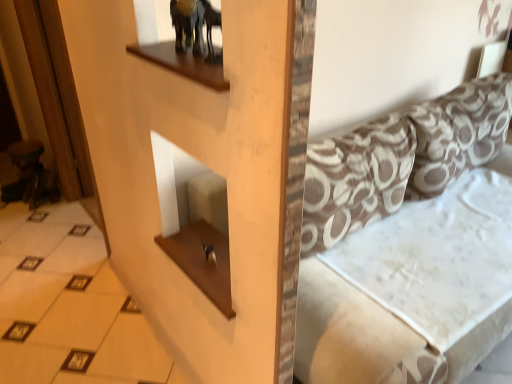
You are a GUI agent. You are given a task and a screenshot of the screen. Output one action in this format:
    pyautogui.click(x=<x>, y=<y>)
    Task: Click on the brown printed fabric pillow at upper right, the 2th pillow positioned from the right
    The image size is (512, 384).
    Given the screenshot: What is the action you would take?
    pyautogui.click(x=355, y=180)

The image size is (512, 384). Describe the element at coordinates (410, 246) in the screenshot. I see `patterned fabric couch at center` at that location.

The image size is (512, 384). In order to click on white glossy tile at lower left in this screenshot , I will do `click(70, 306)`.

At what (x,y) coordinates should I click in order to perform the action: click on brown printed fabric pillow at upper right, the first pillow in the left-to-right sequence. Please return your answer as a coordinate pair (x, y). The image size is (512, 384). Looking at the image, I should click on (355, 180).

Considering the points (370, 227) and (476, 94), which point is behind, point (370, 227) or point (476, 94)?

The point (476, 94) is behind.

Is patterned fabric couch at center inside the boundaries of patterned fabric pillow at right, which is counted as the 1th pillow, starting from the right, or outside?

patterned fabric couch at center is located beyond the bounds of patterned fabric pillow at right, which is counted as the 1th pillow, starting from the right.

Does patterned fabric couch at center have a larger size compared to patterned fabric pillow at right, the 2th pillow positioned from the left?

Correct, patterned fabric couch at center is larger in size than patterned fabric pillow at right, the 2th pillow positioned from the left.

I want to click on the 2nd pillow above when counting from the white glossy tile at lower left (from the image's perspective), so click(458, 132).

Does patterned fabric pillow at right, the 2th pillow positioned from the left, touch white glossy tile at lower left?

patterned fabric pillow at right, the 2th pillow positioned from the left, is not next to white glossy tile at lower left, and they're not touching.

Does patterned fabric pillow at right, which is counted as the 1th pillow, starting from the right, appear on the left side of white glossy tile at lower left?

No.

Does patterned fabric pillow at right, which is counted as the 1th pillow, starting from the right, turn towards white glossy tile at lower left?

No, patterned fabric pillow at right, which is counted as the 1th pillow, starting from the right, is not aimed at white glossy tile at lower left.

Which is in front, point (436, 99) or point (452, 184)?

The point (452, 184) is closer.

Does patterned fabric pillow at right, which is counted as the 1th pillow, starting from the right, turn towards patterned fabric couch at center?

Yes, patterned fabric pillow at right, which is counted as the 1th pillow, starting from the right, faces towards patterned fabric couch at center.

Is patterned fabric pillow at right, the 2th pillow positioned from the left, completely or partially outside of patterned fabric couch at center?

Actually, patterned fabric pillow at right, the 2th pillow positioned from the left, is within patterned fabric couch at center.

Can you confirm if patterned fabric pillow at right, the 2th pillow positioned from the left, is positioned to the left of patterned fabric couch at center?

In fact, patterned fabric pillow at right, the 2th pillow positioned from the left, is to the right of patterned fabric couch at center.

Can you tell me how much white glossy tile at lower left and patterned fabric couch at center differ in facing direction?

The facing directions of white glossy tile at lower left and patterned fabric couch at center are 90 degrees apart.

Which is less distant, (22, 273) or (470, 142)?

Point (22, 273) is positioned farther from the camera compared to point (470, 142).

From a real-world perspective, who is located higher, white glossy tile at lower left or patterned fabric couch at center?

In real-world perspective, patterned fabric couch at center is above.

Is white glossy tile at lower left in contact with patterned fabric couch at center?

No, white glossy tile at lower left is not with patterned fabric couch at center.

Consider the image. Does white glossy tile at lower left lie behind patterned fabric pillow at right, the 2th pillow positioned from the left?

No, white glossy tile at lower left is closer to the viewer.

Is point (16, 242) farther from camera compared to point (425, 167)?

Yes, it is behind point (425, 167).

Where is `tile that is on the left side of patterned fabric pillow at right, which is counted as the 1th pillow, starting from the right`? tile that is on the left side of patterned fabric pillow at right, which is counted as the 1th pillow, starting from the right is located at coordinates (70, 306).

From a real-world perspective, is patterned fabric pillow at right, the 2th pillow positioned from the left, physically located above or below brown printed fabric pillow at upper right, the first pillow in the left-to-right sequence?

patterned fabric pillow at right, the 2th pillow positioned from the left, is situated higher than brown printed fabric pillow at upper right, the first pillow in the left-to-right sequence, in the real world.

Between patterned fabric pillow at right, which is counted as the 1th pillow, starting from the right, and brown printed fabric pillow at upper right, the 2th pillow positioned from the right, which one has less height?

With less height is brown printed fabric pillow at upper right, the 2th pillow positioned from the right.

Is point (440, 163) closer or farther from the camera than point (341, 152)?

Point (440, 163) is farther from the camera than point (341, 152).

Is patterned fabric pillow at right, which is counted as the 1th pillow, starting from the right, at the right side of brown printed fabric pillow at upper right, the 2th pillow positioned from the right?

Indeed, patterned fabric pillow at right, which is counted as the 1th pillow, starting from the right, is positioned on the right side of brown printed fabric pillow at upper right, the 2th pillow positioned from the right.

Is patterned fabric couch at center thinner than brown printed fabric pillow at upper right, the 2th pillow positioned from the right?

In fact, patterned fabric couch at center might be wider than brown printed fabric pillow at upper right, the 2th pillow positioned from the right.

Can you confirm if patterned fabric couch at center is bigger than brown printed fabric pillow at upper right, the 2th pillow positioned from the right?

Yes, patterned fabric couch at center is bigger than brown printed fabric pillow at upper right, the 2th pillow positioned from the right.

Is patterned fabric couch at center facing towards brown printed fabric pillow at upper right, the first pillow in the left-to-right sequence?

No, patterned fabric couch at center is not facing towards brown printed fabric pillow at upper right, the first pillow in the left-to-right sequence.

Locate an element on the screen. This screenshot has height=384, width=512. couch on the left of the patterned fabric pillow at right, which is counted as the 1th pillow, starting from the right is located at coordinates (410, 246).

The image size is (512, 384). What are the coordinates of `tile below the patterned fabric pillow at right, the 2th pillow positioned from the left (from the image's perspective)` in the screenshot? It's located at (70, 306).

Which object lies further to the anchor point white glossy tile at lower left, patterned fabric pillow at right, the 2th pillow positioned from the left, or brown printed fabric pillow at upper right, the first pillow in the left-to-right sequence?

The object further to white glossy tile at lower left is patterned fabric pillow at right, the 2th pillow positioned from the left.

Consider the image. Estimate the real-world distances between objects in this image. Which object is further from brown printed fabric pillow at upper right, the first pillow in the left-to-right sequence, patterned fabric couch at center or white glossy tile at lower left?

Among the two, white glossy tile at lower left is located further to brown printed fabric pillow at upper right, the first pillow in the left-to-right sequence.

Which object lies nearer to the anchor point patterned fabric pillow at right, which is counted as the 1th pillow, starting from the right, brown printed fabric pillow at upper right, the 2th pillow positioned from the right, or patterned fabric couch at center?

patterned fabric couch at center.

Based on their spatial positions, is patterned fabric couch at center or brown printed fabric pillow at upper right, the first pillow in the left-to-right sequence, closer to white glossy tile at lower left?

The object closer to white glossy tile at lower left is brown printed fabric pillow at upper right, the first pillow in the left-to-right sequence.

Considering their positions, is white glossy tile at lower left positioned closer to patterned fabric pillow at right, the 2th pillow positioned from the left, than patterned fabric couch at center?

Based on the image, patterned fabric couch at center appears to be nearer to patterned fabric pillow at right, the 2th pillow positioned from the left.

Which object lies further to the anchor point brown printed fabric pillow at upper right, the 2th pillow positioned from the right, white glossy tile at lower left or patterned fabric couch at center?

white glossy tile at lower left lies further to brown printed fabric pillow at upper right, the 2th pillow positioned from the right, than the other object.

Looking at this image, which object lies further to the anchor point white glossy tile at lower left, brown printed fabric pillow at upper right, the 2th pillow positioned from the right, or patterned fabric couch at center?

patterned fabric couch at center.

When comparing their distances from brown printed fabric pillow at upper right, the first pillow in the left-to-right sequence, does patterned fabric couch at center or patterned fabric pillow at right, which is counted as the 1th pillow, starting from the right, seem further?

patterned fabric pillow at right, which is counted as the 1th pillow, starting from the right, is further to brown printed fabric pillow at upper right, the first pillow in the left-to-right sequence.

At what (x,y) coordinates should I click in order to perform the action: click on pillow situated between white glossy tile at lower left and patterned fabric pillow at right, which is counted as the 1th pillow, starting from the right, from left to right. Please return your answer as a coordinate pair (x, y). The height and width of the screenshot is (384, 512). Looking at the image, I should click on (355, 180).

The image size is (512, 384). Identify the location of couch between white glossy tile at lower left and patterned fabric pillow at right, which is counted as the 1th pillow, starting from the right, from left to right. (410, 246).

Identify the location of pillow between white glossy tile at lower left and patterned fabric couch at center. (355, 180).

I want to click on pillow positioned between patterned fabric couch at center and patterned fabric pillow at right, which is counted as the 1th pillow, starting from the right, from near to far, so click(355, 180).